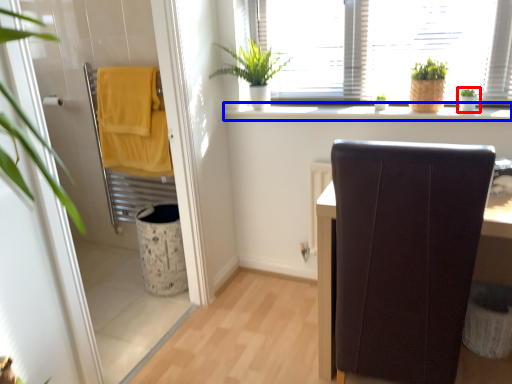
Question: Which point is closer to the camera, houseplant (highlighted by a red box) or window sill (highlighted by a blue box)?

Choices:
 (A) houseplant
 (B) window sill

Answer: (B)